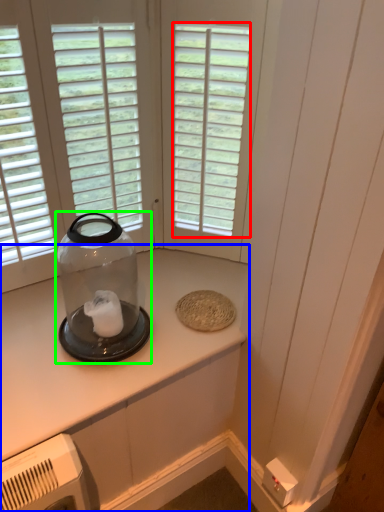
Question: Which object is positioned farthest from window (highlighted by a red box)? Select from countertop (highlighted by a blue box) and glass bottle (highlighted by a green box).

Choices:
 (A) countertop
 (B) glass bottle

Answer: (A)